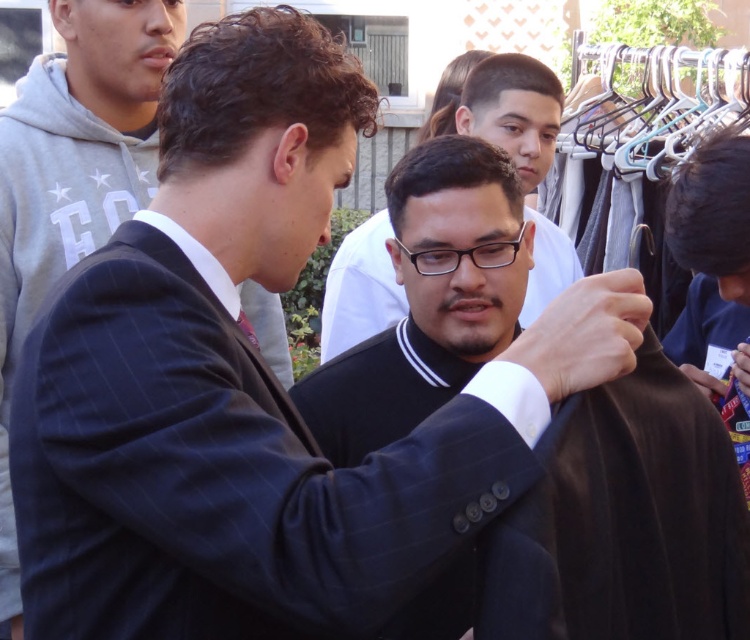
Which is in front, point (726, 481) or point (154, 38)?

Point (726, 481) is more forward.

Can you confirm if black smooth shirt at center is wider than dark blue pinstripe suit at center?

Correct, the width of black smooth shirt at center exceeds that of dark blue pinstripe suit at center.

Is point (604, 628) in front of point (92, 243)?

Yes, point (604, 628) is closer to viewer.

I want to click on black smooth shirt at center, so click(626, 522).

Who is more distant from viewer, (76,257) or (348,285)?

Point (348,285)

How distant is dark blue pinstripe suit at center from black matte shirt at center?

The distance of dark blue pinstripe suit at center from black matte shirt at center is 2.67 meters.

Locate an element on the screen. dark blue pinstripe suit at center is located at coordinates (74, 172).

I want to click on dark blue pinstripe suit at center, so click(74, 172).

At what (x,y) coordinates should I click in order to perform the action: click on black matte shirt at center. Please return your answer as a coordinate pair (x, y). The image size is (750, 640). Looking at the image, I should click on (513, 112).

Who is more distant from viewer, (478, 131) or (238, 324)?

Point (478, 131)

You are a GUI agent. You are given a task and a screenshot of the screen. Output one action in this format:
    pyautogui.click(x=<x>, y=<y>)
    Task: Click on the black matte shirt at center
    Image resolution: width=750 pixels, height=640 pixels.
    Given the screenshot: What is the action you would take?
    pyautogui.click(x=513, y=112)